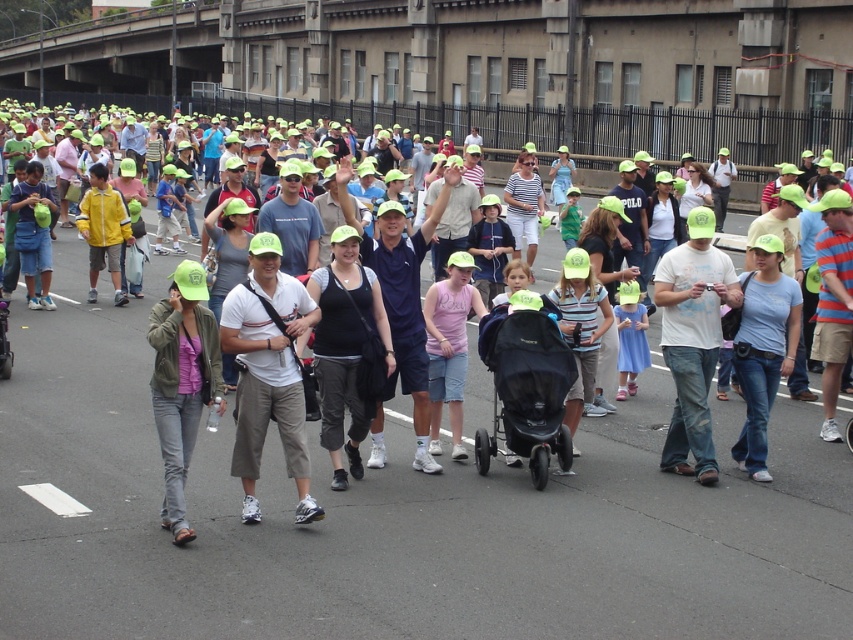
You are a photographer at the charity walk event. You want to capture a photo that includes both the matte black tank top at center and the striped cotton shirt at center. Which clothing item will appear smaller in the photo?

The matte black tank top at center occupies less space than the striped cotton shirt at center, so it will appear smaller in the photo.